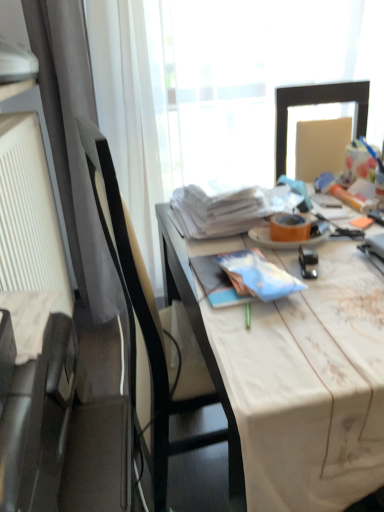
At what (x,y) coordinates should I click in order to perform the action: click on blank space situated above orange matte plate at center (from a real-world perspective). Please return your answer as a coordinate pair (x, y). The image size is (384, 512). Looking at the image, I should click on (288, 224).